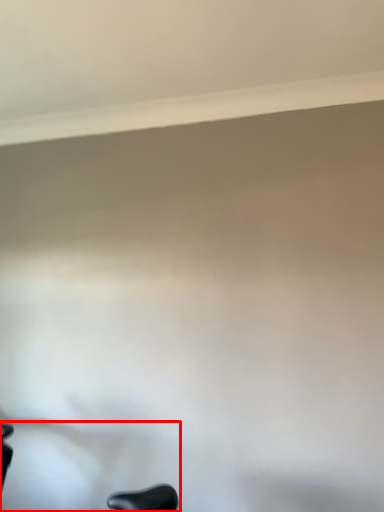
Question: From the image, what is the correct spatial relationship of swivel chair (annotated by the red box) in relation to window sill?

Choices:
 (A) left
 (B) right

Answer: (A)